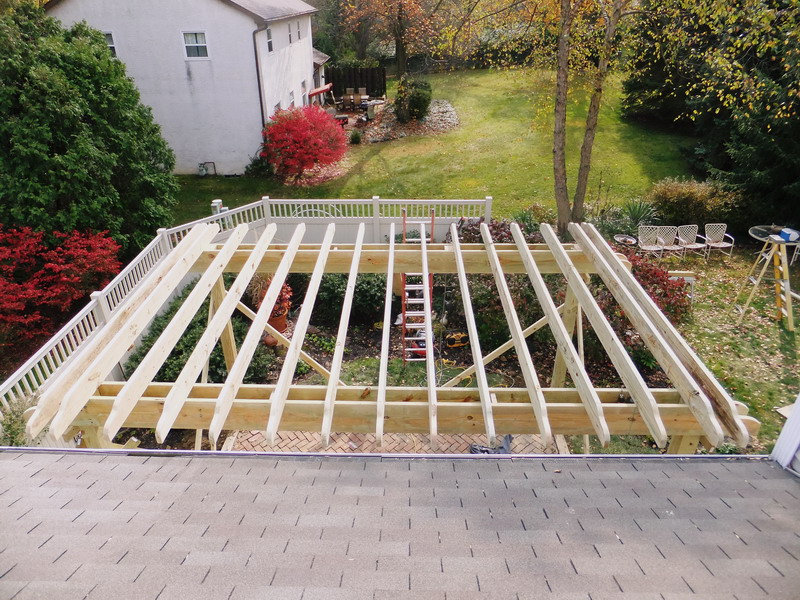
Find the location of `chairs`. chairs is located at coordinates (654, 244), (672, 242), (686, 242), (716, 238).